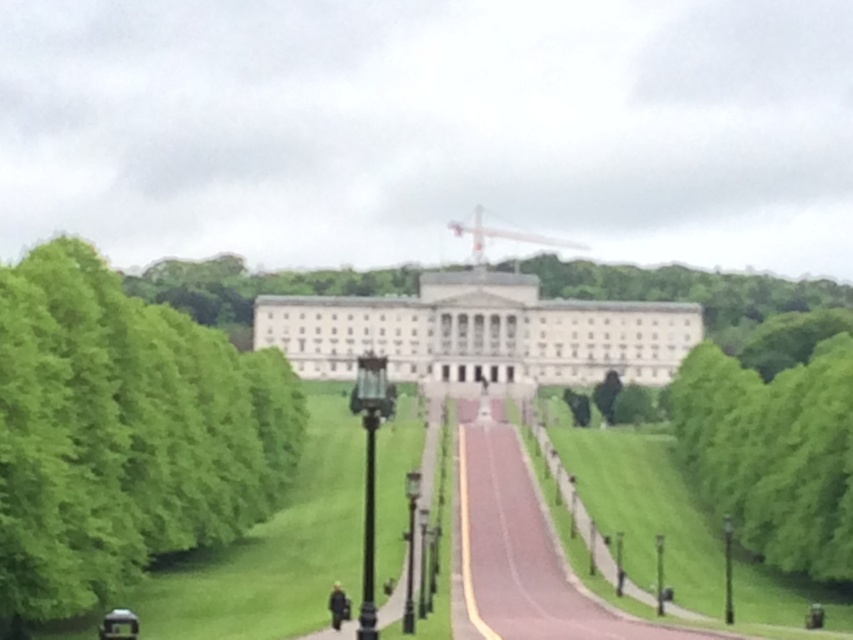
Question: Can you confirm if paved asphalt path at center is positioned below black polished metal lamp post at center?

Choices:
 (A) no
 (B) yes

Answer: (B)

Question: Does green leafy tree at center appear on the right side of black metal lamp post at center?

Choices:
 (A) yes
 (B) no

Answer: (A)

Question: In this image, where is green leafy tree at left located relative to green leafy tree at center?

Choices:
 (A) above
 (B) below

Answer: (A)

Question: Which of these objects is positioned closest to the green leafy tree at center?

Choices:
 (A) white stone building at center
 (B) paved asphalt path at center

Answer: (B)

Question: Which point appears farthest from the camera in this image?

Choices:
 (A) (364, 577)
 (B) (602, 637)

Answer: (B)

Question: Which point is closer to the camera taking this photo?

Choices:
 (A) (270, 344)
 (B) (50, 538)
 (C) (373, 404)

Answer: (C)